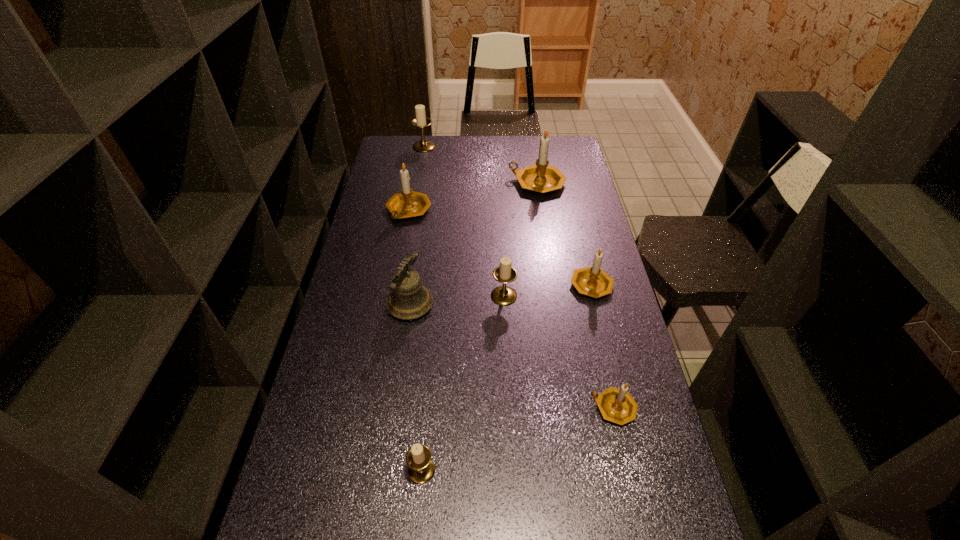
Where is `vacant position located 0.090m on the front of the smallest white candle holder`? Image resolution: width=960 pixels, height=540 pixels. vacant position located 0.090m on the front of the smallest white candle holder is located at coordinates (417, 526).

Locate an element on the screen. The image size is (960, 540). object that is positioned at the far edge is located at coordinates (421, 120).

Locate an element on the screen. This screenshot has height=540, width=960. bell located at the left edge is located at coordinates (409, 299).

At what (x,y) coordinates should I click in order to perform the action: click on object that is at the far left corner. Please return your answer as a coordinate pair (x, y). This screenshot has width=960, height=540. Looking at the image, I should click on (421, 120).

In the image, there is a desktop. Identify the location of vacant space at the far edge. Image resolution: width=960 pixels, height=540 pixels. (448, 136).

At what (x,y) coordinates should I click in order to perform the action: click on free space at the left edge of the desktop. Please return your answer as a coordinate pair (x, y). Looking at the image, I should click on (370, 275).

Where is `vacant area at the right edge`? Image resolution: width=960 pixels, height=540 pixels. vacant area at the right edge is located at coordinates (630, 516).

This screenshot has width=960, height=540. Find the location of `vacant space at the far left corner`. vacant space at the far left corner is located at coordinates (403, 144).

Where is `vacant region between the second biggest gold candle holder and the tallest candle holder`? vacant region between the second biggest gold candle holder and the tallest candle holder is located at coordinates (473, 197).

What are the coordinates of `free area in between the farthest candle holder and the seventh farthest object` in the screenshot? It's located at (518, 277).